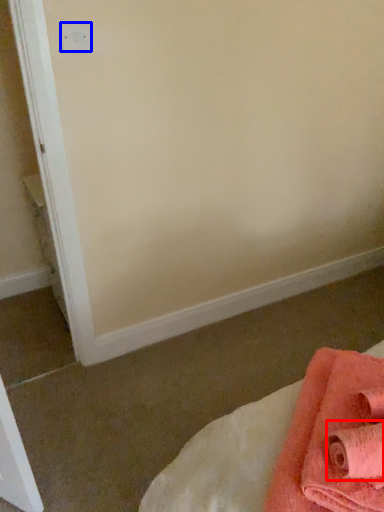
Question: Which point is closer to the camera, bath towel (highlighted by a red box) or electric outlet (highlighted by a blue box)?

Choices:
 (A) bath towel
 (B) electric outlet

Answer: (A)